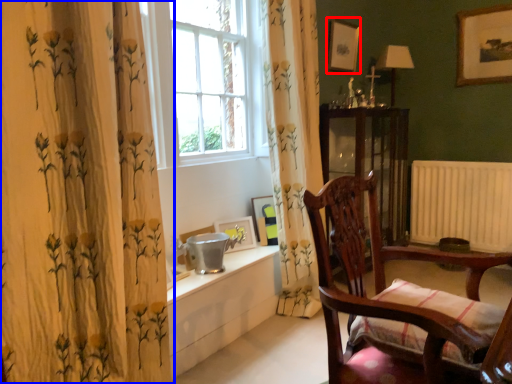
Question: Which of the following is the farthest to the observer, picture frame (highlighted by a red box) or curtain (highlighted by a blue box)?

Choices:
 (A) picture frame
 (B) curtain

Answer: (A)